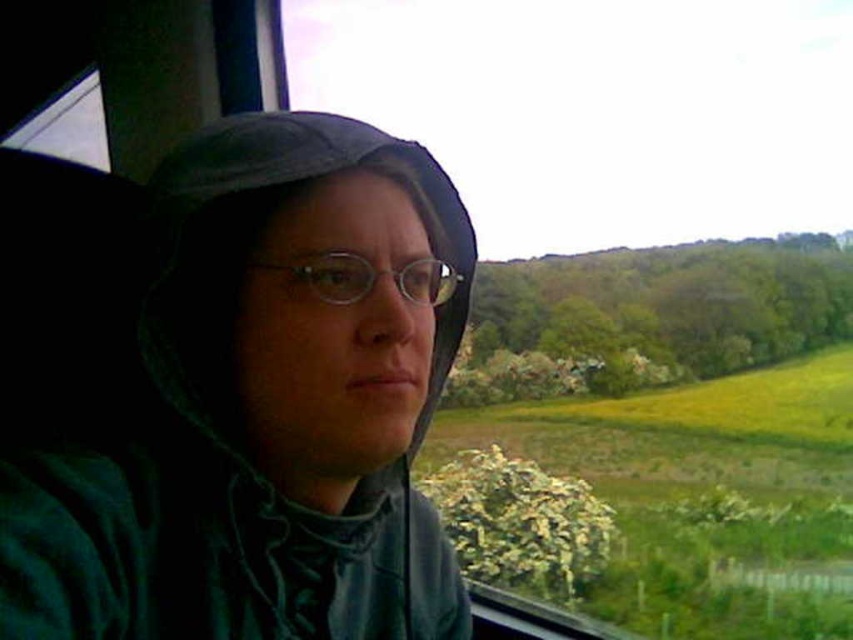
Question: Can you confirm if green matte jacket at left is bigger than clear plastic glasses at center?

Choices:
 (A) yes
 (B) no

Answer: (A)

Question: Is green matte jacket at left closer to the viewer compared to clear plastic glasses at center?

Choices:
 (A) yes
 (B) no

Answer: (A)

Question: Is green matte jacket at left to the right of clear plastic glasses at center from the viewer's perspective?

Choices:
 (A) yes
 (B) no

Answer: (B)

Question: Which point is farther from the camera taking this photo?

Choices:
 (A) (1, 484)
 (B) (436, 276)

Answer: (B)

Question: Which of the following is the closest to the observer?

Choices:
 (A) (299, 269)
 (B) (386, 458)

Answer: (A)

Question: Which point is farther from the camera taking this photo?

Choices:
 (A) (132, 289)
 (B) (346, 296)

Answer: (A)